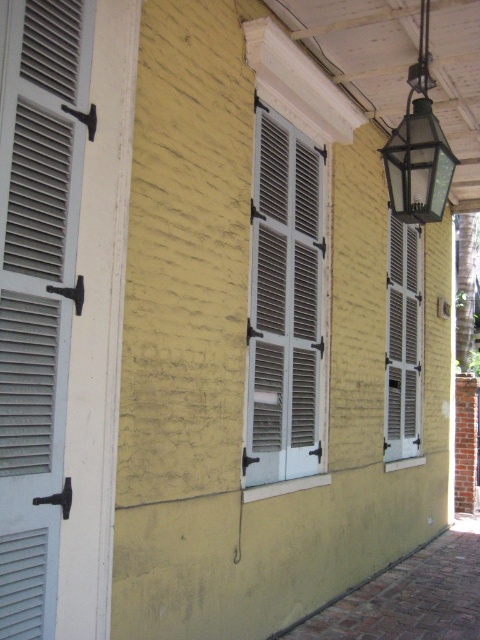
You are standing in front of the building and want to install a new light fixture between the white matte shutters at center and the clear glass lantern at upper right. Based on their positions, which object should the new light be placed closer to?

The white matte shutters at center is located below the clear glass lantern at upper right, so the new light should be placed closer to the white matte shutters at center to maintain spacing between them.

You are a window cleaner standing in front of the building. You need to clean the white matte shutters at center and the white matte shutter at center. Which one is above the other?

The white matte shutters at center is positioned over the white matte shutter at center, meaning it is above the other.

You are an architect reviewing the building facade. You notice two white matte shutters at center and a single white matte shutter at center. Which one takes up more space on the wall?

The white matte shutter at center takes up more space than the white matte shutters at center because the single shutter occupies more area compared to the multiple shutters in the set.